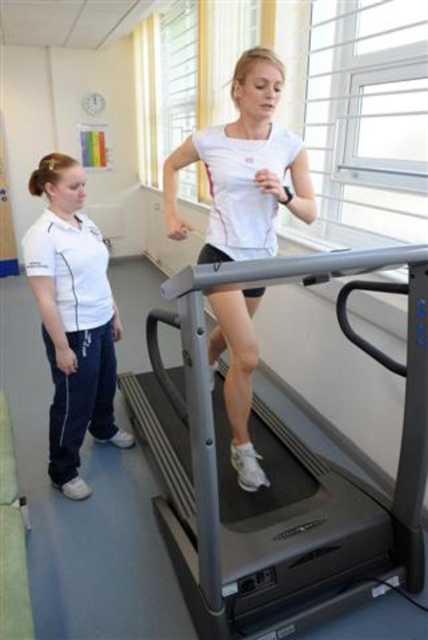
Is white matte running shoe at center above white cotton shirt at left?

Yes, white matte running shoe at center is above white cotton shirt at left.

Between point (253, 157) and point (38, 301), which one is positioned in front?

Point (253, 157) is more forward.

Does point (220, 152) come farther from viewer compared to point (71, 278)?

No, (220, 152) is in front of (71, 278).

Locate an element on the screen. The width and height of the screenshot is (428, 640). white matte running shoe at center is located at coordinates (244, 168).

Can you confirm if gray metallic treadmill at center is taller than white matte running shoe at center?

In fact, gray metallic treadmill at center may be shorter than white matte running shoe at center.

From the picture: Does gray metallic treadmill at center appear on the right side of white matte running shoe at center?

Yes, gray metallic treadmill at center is to the right of white matte running shoe at center.

Image resolution: width=428 pixels, height=640 pixels. What are the coordinates of `gray metallic treadmill at center` in the screenshot? It's located at (288, 481).

Looking at this image, can you confirm if gray metallic treadmill at center is positioned below white cotton shirt at left?

Indeed, gray metallic treadmill at center is positioned under white cotton shirt at left.

Is gray metallic treadmill at center further to camera compared to white cotton shirt at left?

No, it is not.

Does point (425, 452) lie behind point (38, 170)?

That is False.

Identify the location of gray metallic treadmill at center. This screenshot has width=428, height=640. (288, 481).